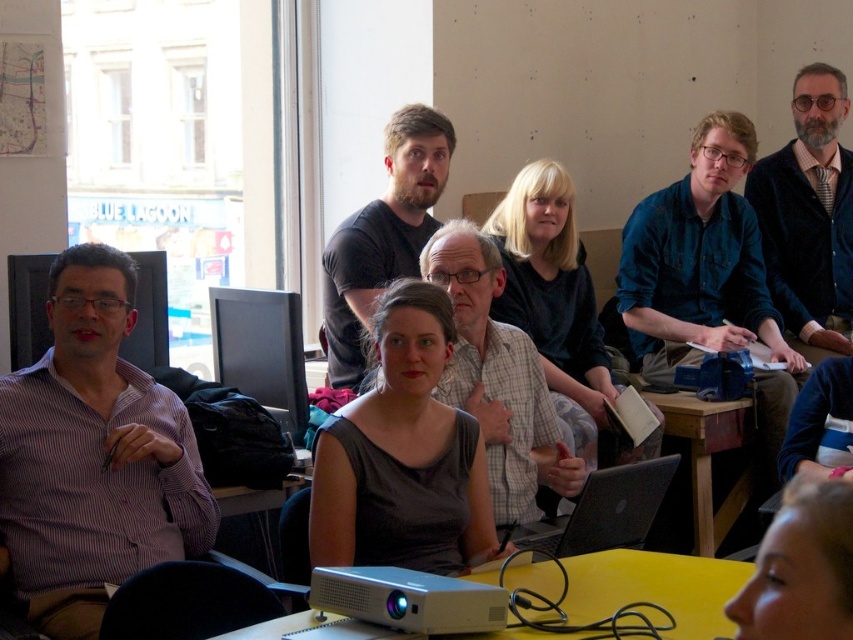
Question: Among these objects, which one is nearest to the camera?

Choices:
 (A) yellow matte table at lower center
 (B) blonde hair at lower right
 (C) matte black shirt at center
 (D) matte black computer at left

Answer: (B)

Question: Which object is positioned farthest from the wooden table at lower center?

Choices:
 (A) matte black monitor at center
 (B) matte black shirt at center
 (C) purple striped shirt at left
 (D) yellow matte table at lower center

Answer: (C)

Question: Which point is farther to the camera?

Choices:
 (A) (619, 532)
 (B) (692, 500)

Answer: (B)

Question: Does plaid shirt at center appear under wooden table at lower center?

Choices:
 (A) no
 (B) yes

Answer: (A)

Question: Is matte black shirt at center further to the viewer compared to blonde hair at lower right?

Choices:
 (A) no
 (B) yes

Answer: (B)

Question: Can you confirm if dark gray fabric dress at center is smaller than velvet jacket at upper right?

Choices:
 (A) no
 (B) yes

Answer: (B)